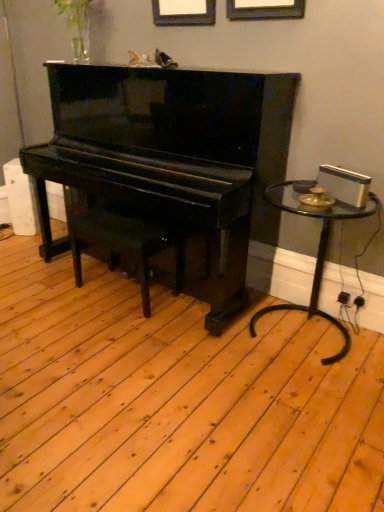
Identify the location of empty space that is ontop of black polished wood music stool at center. The width and height of the screenshot is (384, 512). (129, 215).